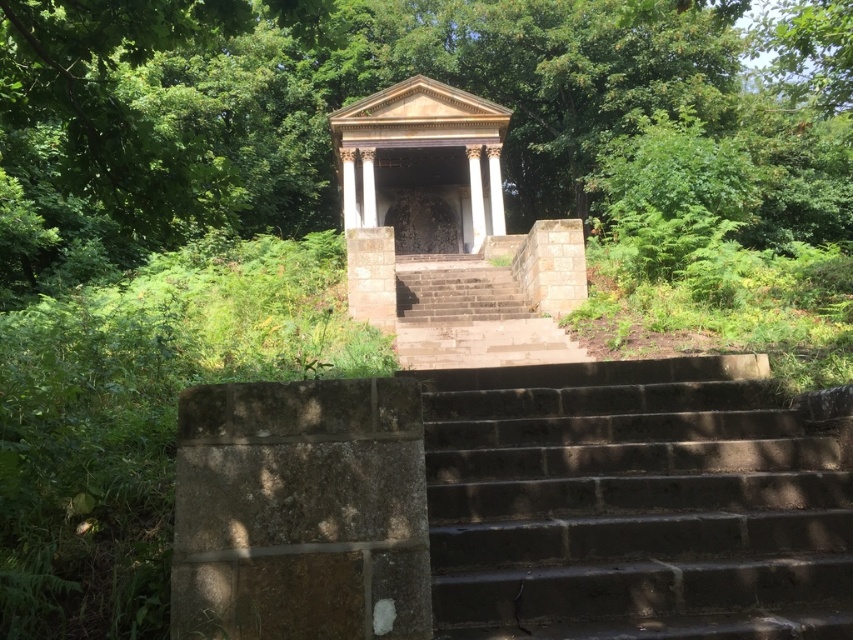
Can you confirm if green leafy tree at upper center is thinner than dark gray concrete stairs at center?

In fact, green leafy tree at upper center might be wider than dark gray concrete stairs at center.

Can you confirm if green leafy tree at upper center is shorter than dark gray concrete stairs at center?

No.

Identify the location of green leafy tree at upper center. (370, 92).

Which of these two, green leafy tree at upper center or brown stone gazebo at center, stands taller?

green leafy tree at upper center

Which is more to the right, green leafy tree at upper center or brown stone gazebo at center?

From the viewer's perspective, green leafy tree at upper center appears more on the right side.

The height and width of the screenshot is (640, 853). In order to click on green leafy tree at upper center in this screenshot , I will do `click(370, 92)`.

Can you confirm if brown stone gazebo at center is positioned below brown stone stairs at center?

No, brown stone gazebo at center is not below brown stone stairs at center.

Who is shorter, brown stone gazebo at center or brown stone stairs at center?

brown stone gazebo at center is shorter.

Does point (427, 246) come closer to viewer compared to point (527, 320)?

No, (427, 246) is behind (527, 320).

Find the location of a particular element. brown stone gazebo at center is located at coordinates (422, 164).